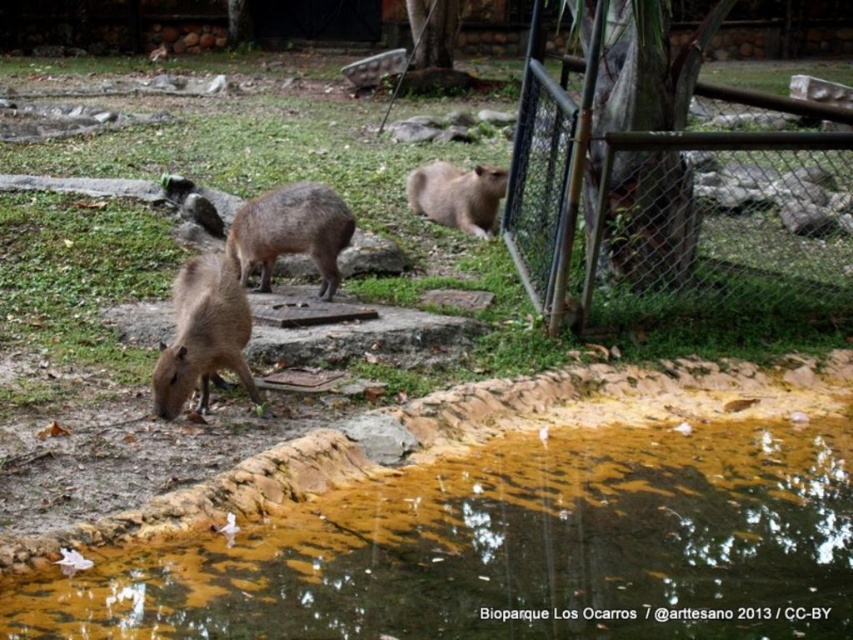
Question: Observing the image, what is the correct spatial positioning of brown furry capybara at center in reference to fuzzy brown capybara at center?

Choices:
 (A) right
 (B) left

Answer: (B)

Question: Among these objects, which one is farthest from the camera?

Choices:
 (A) brown algae water at lower center
 (B) fuzzy brown capybara at center
 (C) brown furry capybara at center
 (D) brown furry capybara at lower left

Answer: (B)

Question: Based on their relative distances, which object is nearer to the fuzzy brown capybara at center?

Choices:
 (A) brown furry capybara at lower left
 (B) brown furry capybara at center
 (C) brown algae water at lower center
 (D) metal mesh fence at upper right

Answer: (D)

Question: Which point is farther to the camera?

Choices:
 (A) brown algae water at lower center
 (B) metal mesh fence at upper right

Answer: (B)

Question: Can you confirm if brown furry capybara at center is bigger than fuzzy brown capybara at center?

Choices:
 (A) yes
 (B) no

Answer: (B)

Question: Is metal mesh fence at upper right to the left of brown furry capybara at lower left from the viewer's perspective?

Choices:
 (A) yes
 (B) no

Answer: (B)